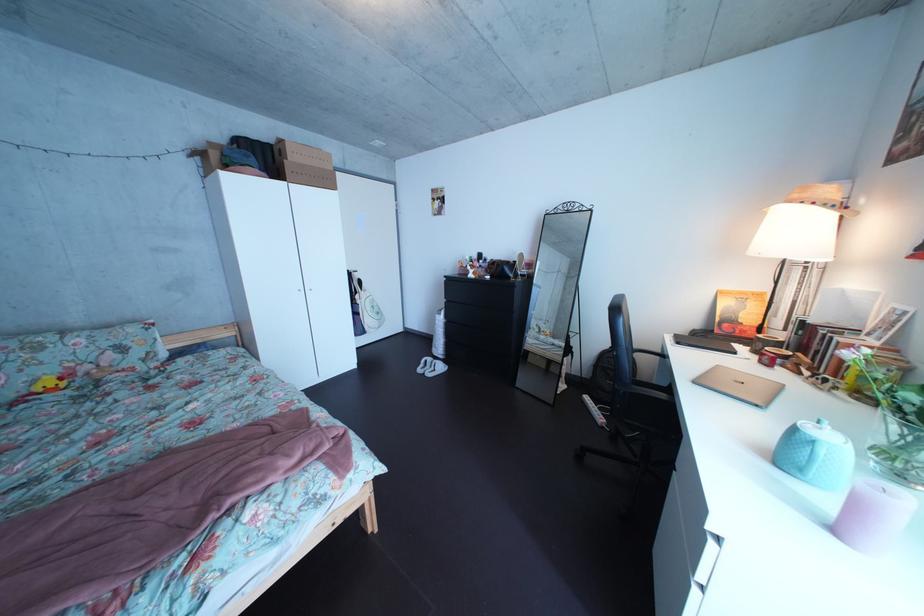
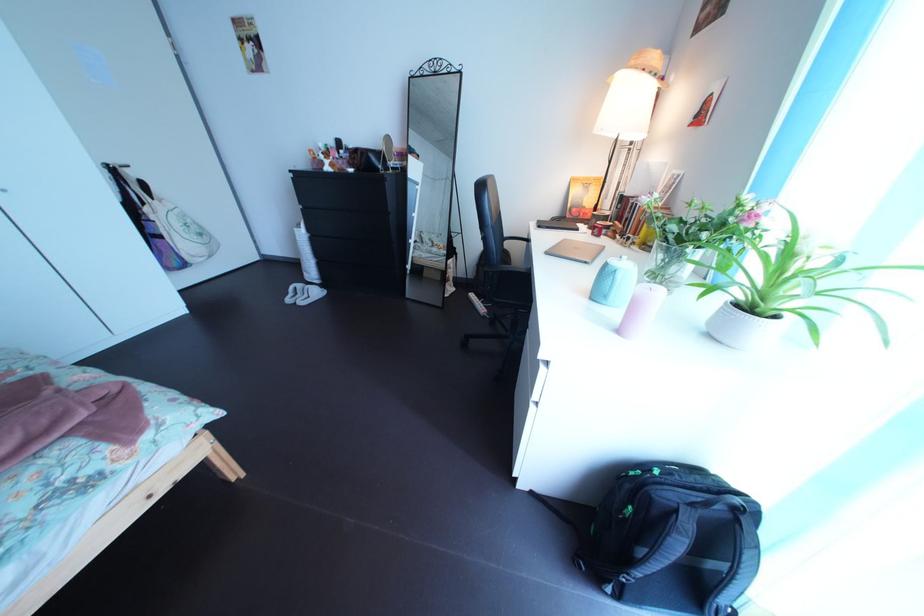
Find the pixel in the second image that matches point 817,479 in the first image.

(621, 305)